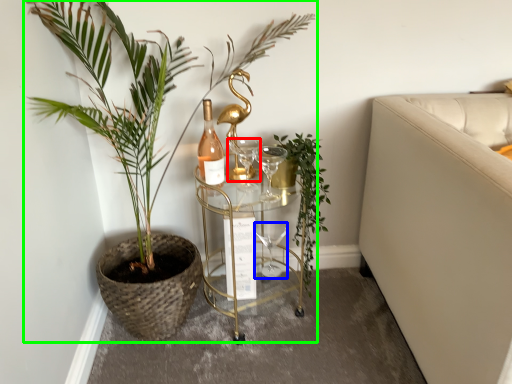
Question: Which object is the closest to the wine glass (highlighted by a red box)? Choose among these: wine glass (highlighted by a blue box) or houseplant (highlighted by a green box).

Choices:
 (A) wine glass
 (B) houseplant

Answer: (B)